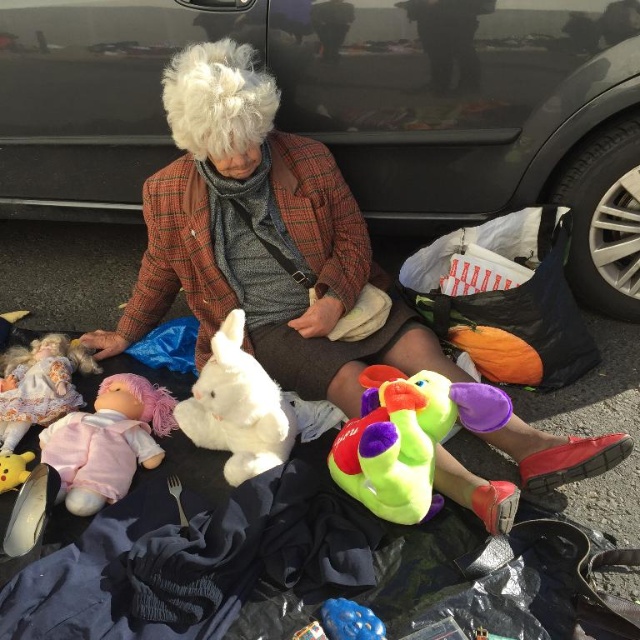
Question: Which object appears farthest from the camera in this image?

Choices:
 (A) soft pink fabric doll at lower left
 (B) matte pink doll at lower left
 (C) black glossy car at upper center

Answer: (B)

Question: Does soft pink fabric doll at lower left have a lesser width compared to white plush rabbit at center?

Choices:
 (A) no
 (B) yes

Answer: (A)

Question: Which point is closer to the camera?

Choices:
 (A) (72, 388)
 (B) (420, 196)
 (C) (285, 404)

Answer: (C)

Question: Can you confirm if black glossy car at upper center is bigger than soft pink fabric doll at lower left?

Choices:
 (A) no
 (B) yes

Answer: (B)

Question: Is plush multicolored toy at lower center to the left of soft pink fabric doll at lower left from the viewer's perspective?

Choices:
 (A) yes
 (B) no

Answer: (B)

Question: Considering the real-world distances, which object is closest to the plush multicolored toy at lower center?

Choices:
 (A) matte pink doll at lower left
 (B) black glossy car at upper center

Answer: (B)